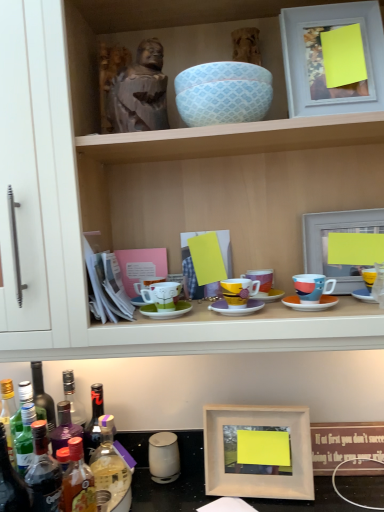
Question: Is purple matte saucer at center, marked as the 2th saucer in a right-to-left arrangement, to the left of matte white picture frame at upper right, the first picture frame in the top-to-bottom sequence, from the viewer's perspective?

Choices:
 (A) yes
 (B) no

Answer: (A)

Question: Can you confirm if purple matte saucer at center, which is the 2th saucer from left to right, is thinner than matte white picture frame at upper right, the first picture frame in the top-to-bottom sequence?

Choices:
 (A) no
 (B) yes

Answer: (B)

Question: Does purple matte saucer at center, marked as the 2th saucer in a right-to-left arrangement, turn towards matte white picture frame at upper right, the fourth picture frame when ordered from bottom to top?

Choices:
 (A) yes
 (B) no

Answer: (B)

Question: From a real-world perspective, does purple matte saucer at center, which is the 2th saucer from left to right, stand above matte white picture frame at upper right, the fourth picture frame when ordered from bottom to top?

Choices:
 (A) yes
 (B) no

Answer: (B)

Question: Is purple matte saucer at center, marked as the 2th saucer in a right-to-left arrangement, closer to camera compared to matte white picture frame at upper right, the first picture frame in the top-to-bottom sequence?

Choices:
 (A) yes
 (B) no

Answer: (B)

Question: From the image's perspective, is purple matte saucer at center, marked as the 2th saucer in a right-to-left arrangement, under matte white picture frame at upper right, the fourth picture frame when ordered from bottom to top?

Choices:
 (A) yes
 (B) no

Answer: (A)

Question: Would you say matte ceramic mug at right, which ranks as the 4th coffee cup in left-to-right order, is outside matte white picture frame at upper right, the first picture frame in the top-to-bottom sequence?

Choices:
 (A) yes
 (B) no

Answer: (A)

Question: From the image's perspective, does matte ceramic mug at right, which ranks as the 4th coffee cup in left-to-right order, appear lower than matte white picture frame at upper right, the fourth picture frame when ordered from bottom to top?

Choices:
 (A) yes
 (B) no

Answer: (A)

Question: Is matte white picture frame at upper right, the first picture frame in the top-to-bottom sequence, completely or partially inside matte ceramic mug at right, which ranks as the 4th coffee cup in left-to-right order?

Choices:
 (A) yes
 (B) no

Answer: (B)

Question: Is matte ceramic mug at right, which is the 1th coffee cup in right-to-left order, to the left of matte white picture frame at upper right, the fourth picture frame when ordered from bottom to top, from the viewer's perspective?

Choices:
 (A) no
 (B) yes

Answer: (B)

Question: Is matte white picture frame at upper right, the fourth picture frame when ordered from bottom to top, at the back of matte ceramic mug at right, which ranks as the 4th coffee cup in left-to-right order?

Choices:
 (A) yes
 (B) no

Answer: (B)

Question: From the image's perspective, is matte ceramic mug at right, which ranks as the 4th coffee cup in left-to-right order, above matte white picture frame at upper right, the first picture frame in the top-to-bottom sequence?

Choices:
 (A) no
 (B) yes

Answer: (A)

Question: Could translucent plastic bottle at lower left, the first bottle viewed from the right, be considered to be inside translucent plastic bottle at lower left, which is the 2th bottle from right to left?

Choices:
 (A) yes
 (B) no

Answer: (B)